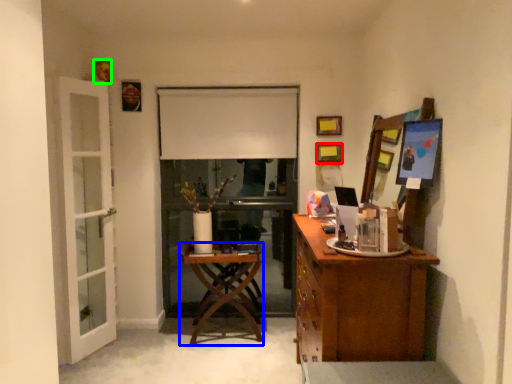
Question: Which is farther away from picture frame (highlighted by a red box)? desk (highlighted by a blue box) or picture frame (highlighted by a green box)?

Choices:
 (A) desk
 (B) picture frame

Answer: (B)